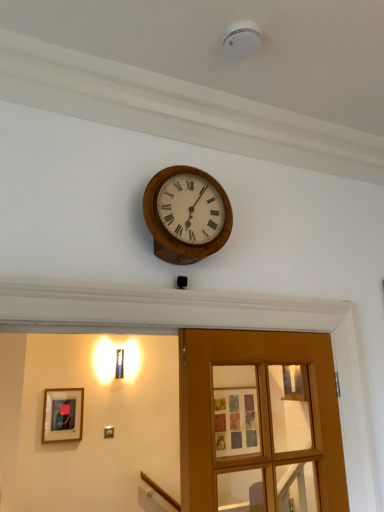
Question: Can we say wooden framed picture at lower left lies outside wooden glass door at center?

Choices:
 (A) yes
 (B) no

Answer: (A)

Question: From the image's perspective, would you say wooden framed picture at lower left is shown under wooden glass door at center?

Choices:
 (A) no
 (B) yes

Answer: (B)

Question: Does wooden framed picture at lower left come behind wooden glass door at center?

Choices:
 (A) no
 (B) yes

Answer: (B)

Question: Is wooden framed picture at lower left wider than wooden glass door at center?

Choices:
 (A) no
 (B) yes

Answer: (A)

Question: Considering the relative sizes of wooden framed picture at lower left and wooden glass door at center in the image provided, is wooden framed picture at lower left taller than wooden glass door at center?

Choices:
 (A) no
 (B) yes

Answer: (A)

Question: From the image's perspective, relative to wooden framed picture at lower left, is wooden glass door at center above or below?

Choices:
 (A) above
 (B) below

Answer: (A)

Question: Based on their sizes in the image, would you say wooden glass door at center is bigger or smaller than wooden framed picture at lower left?

Choices:
 (A) small
 (B) big

Answer: (B)

Question: From a real-world perspective, relative to wooden framed picture at lower left, is wooden glass door at center vertically above or below?

Choices:
 (A) below
 (B) above

Answer: (B)

Question: In terms of width, does wooden glass door at center look wider or thinner when compared to wooden framed picture at lower left?

Choices:
 (A) thin
 (B) wide

Answer: (B)

Question: Choose the correct answer: Is wooden framed picture at lower left inside wooden glass door at center or outside it?

Choices:
 (A) inside
 (B) outside

Answer: (B)

Question: From a real-world perspective, is wooden framed picture at lower left positioned above or below wooden glass door at center?

Choices:
 (A) above
 (B) below

Answer: (B)

Question: Is point (69, 409) closer or farther from the camera than point (339, 445)?

Choices:
 (A) closer
 (B) farther

Answer: (B)

Question: In terms of size, does wooden framed picture at lower left appear bigger or smaller than wooden glass door at center?

Choices:
 (A) big
 (B) small

Answer: (B)

Question: Is wooden wall clock at upper center spatially inside wooden framed picture at lower left, or outside of it?

Choices:
 (A) inside
 (B) outside

Answer: (B)

Question: In terms of size, does wooden wall clock at upper center appear bigger or smaller than wooden framed picture at lower left?

Choices:
 (A) small
 (B) big

Answer: (B)